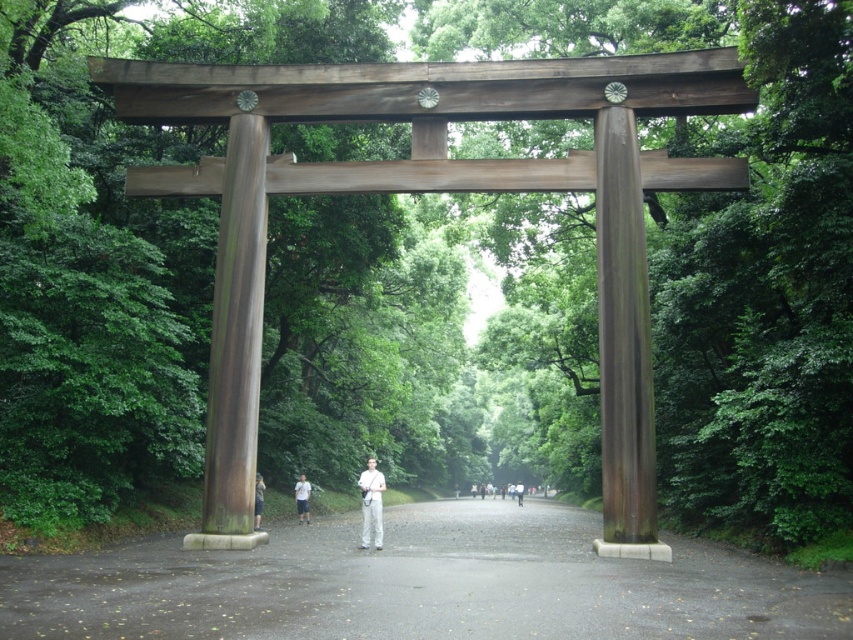
Question: Which of the following is the closest to the observer?

Choices:
 (A) light gray fabric pants at center
 (B) glossy wood pillar at center
 (C) bronze polished pillar at center

Answer: (B)

Question: Which is nearer to the bronze polished pillar at center?

Choices:
 (A) white cotton shirt at center
 (B) glossy wood pillar at center
 (C) dull gray asphalt at center

Answer: (B)

Question: Can you confirm if dull gray asphalt at center is wider than white matte pants at center?

Choices:
 (A) yes
 (B) no

Answer: (A)

Question: Is bronze polished pillar at center further to camera compared to white cotton shirt at center?

Choices:
 (A) yes
 (B) no

Answer: (B)

Question: Which object appears closest to the camera in this image?

Choices:
 (A) glossy wood pillar at center
 (B) light gray fabric pants at center
 (C) dull gray asphalt at center
 (D) light gray pants at center

Answer: (C)

Question: Is bronze polished pillar at center positioned behind white cotton shirt at center?

Choices:
 (A) yes
 (B) no

Answer: (B)